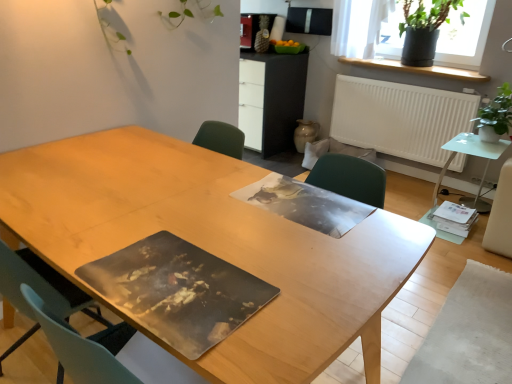
In order to click on free spot above wooden table at center, the 1th table positioned from the left (from a real-world perspective) in this screenshot , I will do `click(134, 192)`.